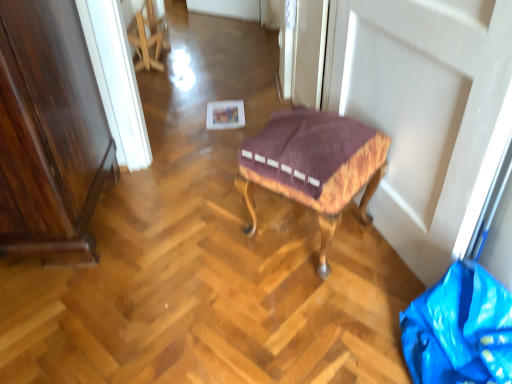
Identify the location of free space in front of velvet upholstered stool at center. (337, 317).